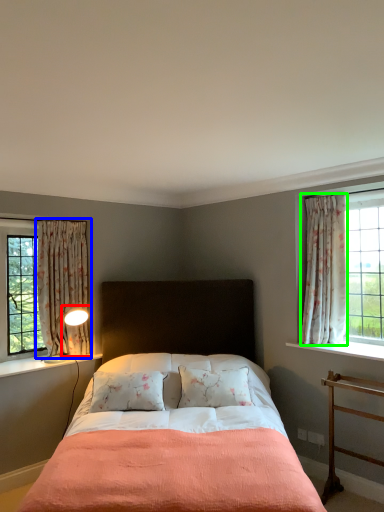
Question: Which object is the farthest from table lamp (highlighted by a red box)? Choose among these: curtain (highlighted by a blue box) or curtain (highlighted by a green box).

Choices:
 (A) curtain
 (B) curtain

Answer: (B)